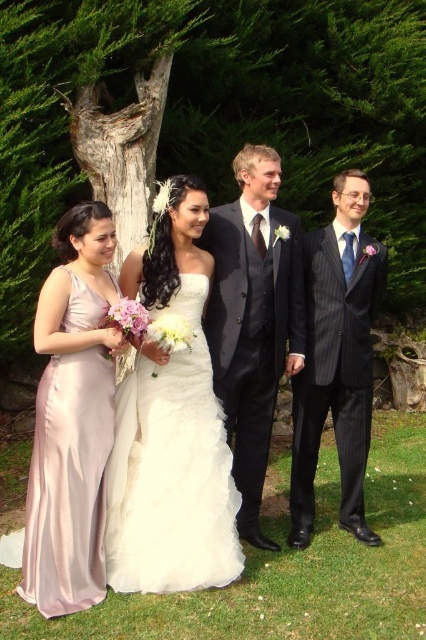
Is rough bark tree at center above dark gray suit at center?

Yes, rough bark tree at center is above dark gray suit at center.

Which is in front, point (204, 134) or point (227, 392)?

Point (227, 392)

Where is `rough bark tree at center`? rough bark tree at center is located at coordinates (311, 109).

What are the coordinates of `rough bark tree at center` in the screenshot? It's located at (311, 109).

Does rough bark tree at center appear over silky pink dress at left?

Indeed, rough bark tree at center is positioned over silky pink dress at left.

Can you confirm if rough bark tree at center is positioned below silky pink dress at left?

Incorrect, rough bark tree at center is not positioned below silky pink dress at left.

Is point (351, 154) farther from viewer compared to point (80, 456)?

That is True.

The width and height of the screenshot is (426, 640). What are the coordinates of `rough bark tree at center` in the screenshot? It's located at (311, 109).

Based on the photo, does white satin dress at center have a lesser height compared to dark pinstripe suit at right?

Yes, white satin dress at center is shorter than dark pinstripe suit at right.

Is point (230, 524) positioned after point (356, 180)?

No, (230, 524) is closer to viewer.

You are a GUI agent. You are given a task and a screenshot of the screen. Output one action in this format:
    pyautogui.click(x=<x>, y=<y>)
    Task: Click on the white satin dress at center
    The image size is (426, 640).
    Given the screenshot: What is the action you would take?
    pyautogui.click(x=172, y=470)